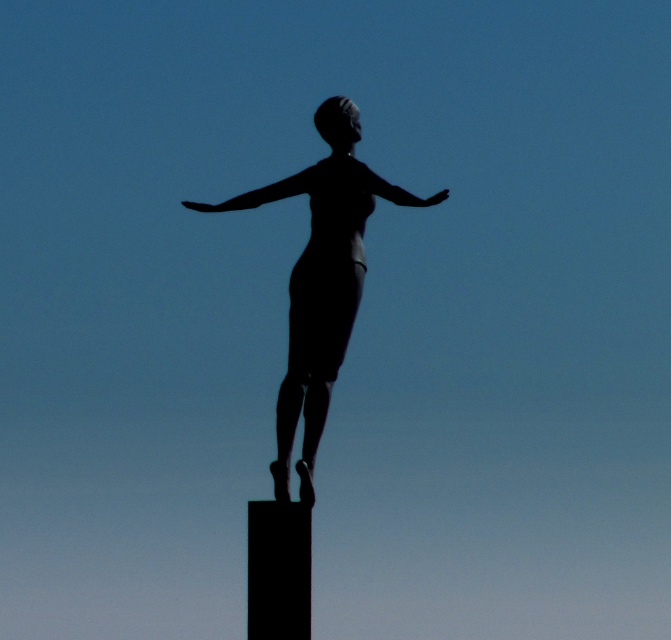
At what (x,y) coordinates should I click in order to perform the action: click on black matte arm at center. Please return your answer as a coordinate pair (x, y). Image resolution: width=671 pixels, height=640 pixels. Looking at the image, I should click on pos(260,193).

Is point (266, 198) farther from camera compared to point (407, 196)?

That is True.

You are a GUI agent. You are given a task and a screenshot of the screen. Output one action in this format:
    pyautogui.click(x=<x>, y=<y>)
    Task: Click on the black matte arm at center
    The height and width of the screenshot is (640, 671).
    Given the screenshot: What is the action you would take?
    pyautogui.click(x=260, y=193)

This screenshot has height=640, width=671. In order to click on black matte pole at center in this screenshot , I will do `click(278, 570)`.

Which is in front, point (285, 536) or point (258, 189)?

Point (285, 536) is in front.

Does point (303, 579) lie in front of point (311, 179)?

Yes, it is in front of point (311, 179).

Locate an element on the screen. black matte pole at center is located at coordinates (278, 570).

Between point (297, 406) and point (282, 195), which one is positioned behind?

Positioned behind is point (282, 195).

Is silhouette statue at center bigger than black matte arm at center?

Yes, silhouette statue at center is bigger than black matte arm at center.

Where is `silhouette statue at center`? The image size is (671, 640). silhouette statue at center is located at coordinates (317, 285).